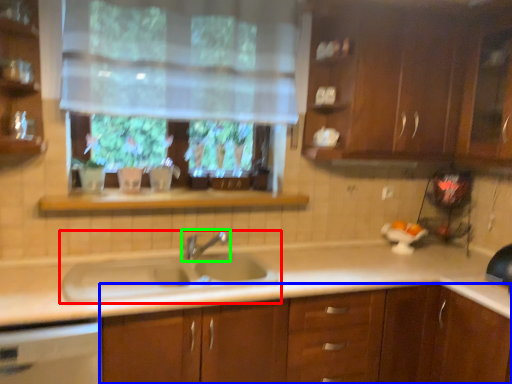
Question: Based on their relative distances, which object is nearer to sink (highlighted by a red box)? Choose from cabinetry (highlighted by a blue box) and tap (highlighted by a green box).

Choices:
 (A) cabinetry
 (B) tap

Answer: (B)